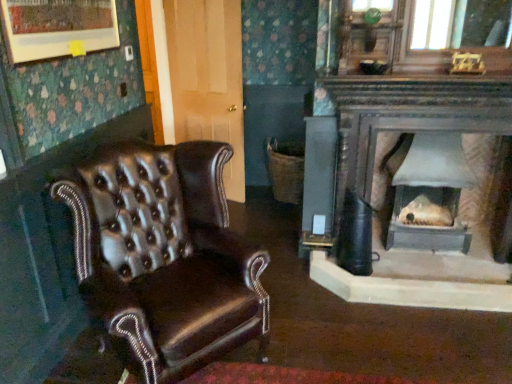
What is the approximate width of matte gray wood burning stove at center?

The width of matte gray wood burning stove at center is 16.42 inches.

Describe the element at coordinates (430, 195) in the screenshot. I see `matte gray wood burning stove at center` at that location.

In order to face matte gray wood burning stove at center, should I rotate leftwards or rightwards?

To face it directly, rotate right by 22.223 degrees.

Where is `matte gray wood burning stove at center`? This screenshot has width=512, height=384. matte gray wood burning stove at center is located at coordinates (430, 195).

This screenshot has height=384, width=512. Describe the element at coordinates (164, 255) in the screenshot. I see `shiny brown leather chair at left` at that location.

In order to face shiny brown leather chair at left, should I rotate leftwards or rightwards?

You should rotate left by 12.497 degrees.

Identify the location of shiny brown leather chair at left. (164, 255).

Find the location of a particular element. This screenshot has width=512, height=384. matte gray wood burning stove at center is located at coordinates (430, 195).

Considering the positions of objects shiny brown leather chair at left and matte gray wood burning stove at center in the image provided, who is more to the left, shiny brown leather chair at left or matte gray wood burning stove at center?

From the viewer's perspective, shiny brown leather chair at left appears more on the left side.

Is shiny brown leather chair at left in front of or behind matte gray wood burning stove at center in the image?

shiny brown leather chair at left is in front of matte gray wood burning stove at center.

Is point (110, 197) behind point (445, 150)?

No, it is in front of (445, 150).

From the image's perspective, would you say shiny brown leather chair at left is shown under matte gray wood burning stove at center?

Correct, shiny brown leather chair at left appears lower than matte gray wood burning stove at center in the image.

Consider the image. From a real-world perspective, is shiny brown leather chair at left under matte gray wood burning stove at center?

No, from a real-world perspective, shiny brown leather chair at left is not beneath matte gray wood burning stove at center.

Based on the photo, looking at their sizes, would you say shiny brown leather chair at left is wider or thinner than matte gray wood burning stove at center?

Clearly, shiny brown leather chair at left has more width compared to matte gray wood burning stove at center.

Considering the sizes of objects shiny brown leather chair at left and matte gray wood burning stove at center in the image provided, who is shorter, shiny brown leather chair at left or matte gray wood burning stove at center?

matte gray wood burning stove at center.

In the scene shown: Which of these two, shiny brown leather chair at left or matte gray wood burning stove at center, is bigger?

shiny brown leather chair at left.

Is shiny brown leather chair at left not inside matte gray wood burning stove at center?

shiny brown leather chair at left lies outside matte gray wood burning stove at center's area.

Is shiny brown leather chair at left placed right next to matte gray wood burning stove at center?

No.

Does shiny brown leather chair at left turn towards matte gray wood burning stove at center?

No.

How distant is shiny brown leather chair at left from matte gray wood burning stove at center?

They are 1.72 meters apart.

I want to click on wood burning stove that appears behind the shiny brown leather chair at left, so click(430, 195).

Considering the positions of objects matte gray wood burning stove at center and shiny brown leather chair at left in the image provided, who is more to the left, matte gray wood burning stove at center or shiny brown leather chair at left?

From the viewer's perspective, shiny brown leather chair at left appears more on the left side.

Relative to shiny brown leather chair at left, is matte gray wood burning stove at center in front or behind?

In the image, matte gray wood burning stove at center appears behind shiny brown leather chair at left.

Considering the points (436, 223) and (195, 308), which point is behind, point (436, 223) or point (195, 308)?

The point (436, 223) is behind.

Based on the photo, from the image's perspective, is matte gray wood burning stove at center above shiny brown leather chair at left?

Yes, from the image's perspective, matte gray wood burning stove at center is on top of shiny brown leather chair at left.

From a real-world perspective, which object rests below the other?

matte gray wood burning stove at center, from a real-world perspective.

Considering the relative sizes of matte gray wood burning stove at center and shiny brown leather chair at left in the image provided, is matte gray wood burning stove at center wider than shiny brown leather chair at left?

Incorrect, the width of matte gray wood burning stove at center does not surpass that of shiny brown leather chair at left.

Considering the sizes of objects matte gray wood burning stove at center and shiny brown leather chair at left in the image provided, who is taller, matte gray wood burning stove at center or shiny brown leather chair at left?

shiny brown leather chair at left is taller.

Can you confirm if matte gray wood burning stove at center is smaller than shiny brown leather chair at left?

Yes, matte gray wood burning stove at center is smaller than shiny brown leather chair at left.

Would you say matte gray wood burning stove at center is inside or outside shiny brown leather chair at left?

matte gray wood burning stove at center exists outside the volume of shiny brown leather chair at left.

In the scene shown: Is matte gray wood burning stove at center next to shiny brown leather chair at left and touching it?

There is a gap between matte gray wood burning stove at center and shiny brown leather chair at left.

Could you tell me if matte gray wood burning stove at center is facing shiny brown leather chair at left?

No, matte gray wood burning stove at center is not oriented towards shiny brown leather chair at left.

How distant is matte gray wood burning stove at center from shiny brown leather chair at left?

The distance of matte gray wood burning stove at center from shiny brown leather chair at left is 5.66 feet.

Identify the location of chair below the matte gray wood burning stove at center (from the image's perspective). Image resolution: width=512 pixels, height=384 pixels. (164, 255).

Identify the location of wood burning stove on the right of shiny brown leather chair at left. This screenshot has height=384, width=512. (430, 195).

Where is `wood burning stove behind the shiny brown leather chair at left`? This screenshot has height=384, width=512. wood burning stove behind the shiny brown leather chair at left is located at coordinates (430, 195).